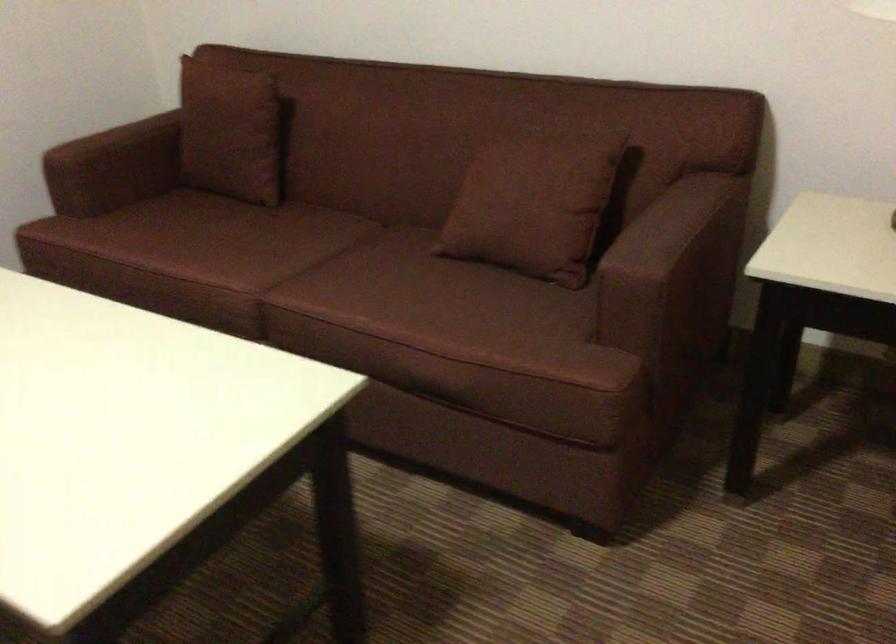
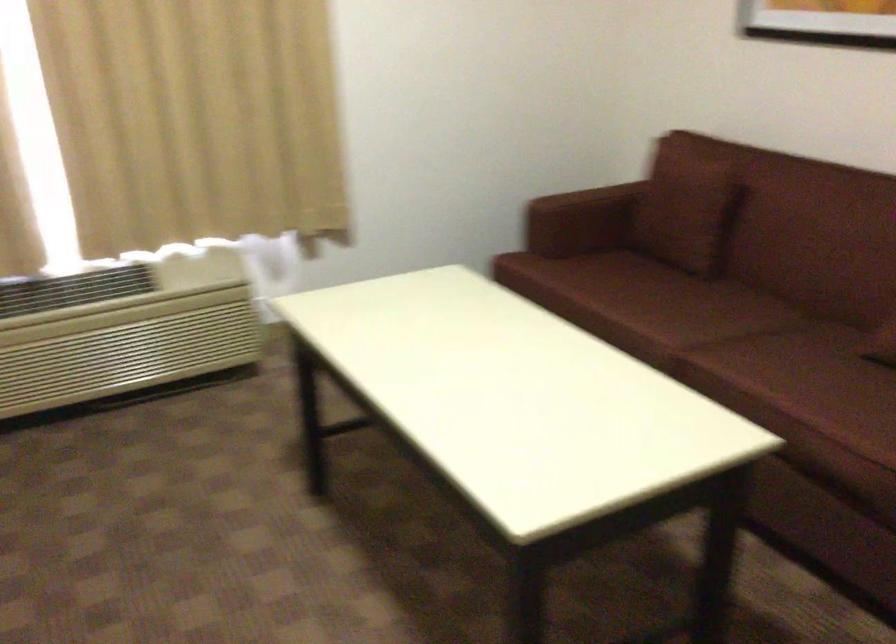
Locate, in the second image, the point that corresponds to point (263, 250) in the first image.

(682, 310)